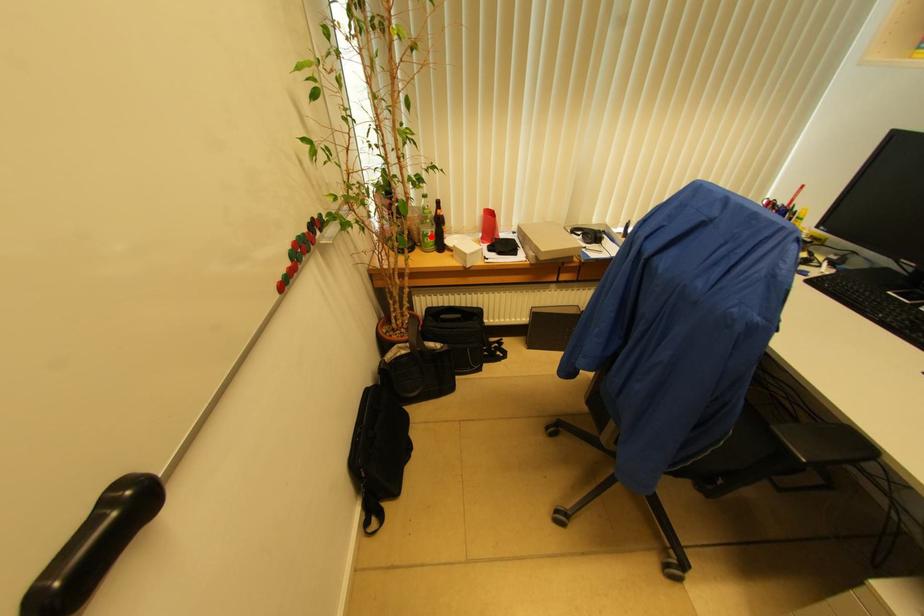
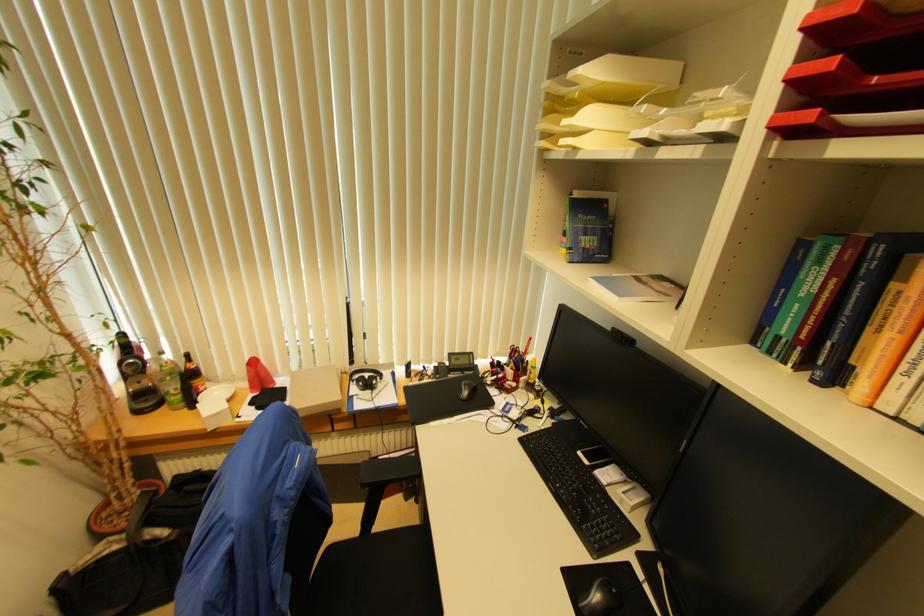
In the second image, find the point that corresponds to the highlighted location in the first image.

(174, 394)